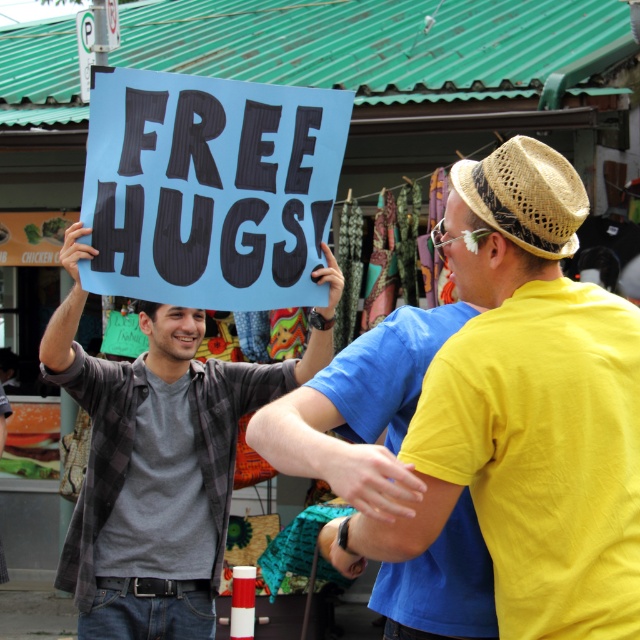
Between yellow matte shirt at right and blue paper sign at upper center, which one has more height?

Standing taller between the two is yellow matte shirt at right.

The width and height of the screenshot is (640, 640). What do you see at coordinates (536, 410) in the screenshot? I see `yellow matte shirt at right` at bounding box center [536, 410].

Find the location of a particular element. This screenshot has height=640, width=640. yellow matte shirt at right is located at coordinates (536, 410).

This screenshot has height=640, width=640. What do you see at coordinates (536, 410) in the screenshot?
I see `yellow matte shirt at right` at bounding box center [536, 410].

Based on the photo, does yellow matte shirt at right appear on the right side of matte gray shirt at center?

Indeed, yellow matte shirt at right is positioned on the right side of matte gray shirt at center.

Where is `yellow matte shirt at right`? yellow matte shirt at right is located at coordinates (536, 410).

Who is positioned more to the left, yellow matte shirt at right or straw woven hat at upper right?

Positioned to the left is straw woven hat at upper right.

Can you confirm if yellow matte shirt at right is positioned to the left of straw woven hat at upper right?

In fact, yellow matte shirt at right is to the right of straw woven hat at upper right.

Between point (506, 484) and point (524, 211), which one is positioned in front?

Point (506, 484) is in front.

At what (x,y) coordinates should I click in order to perform the action: click on yellow matte shirt at right. Please return your answer as a coordinate pair (x, y). Looking at the image, I should click on (536, 410).